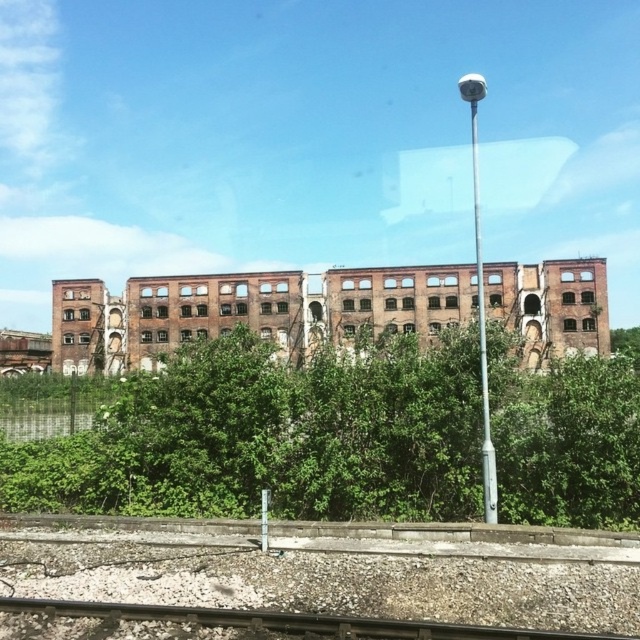
Question: Can you confirm if brown brick building at center is bigger than smooth metal train track at bottom center?

Choices:
 (A) no
 (B) yes

Answer: (B)

Question: Can you confirm if green leafy tree at center is thinner than smooth metal train track at bottom center?

Choices:
 (A) yes
 (B) no

Answer: (B)

Question: Which of the following is the closest to the observer?

Choices:
 (A) brown brick building at center
 (B) green leafy tree at center
 (C) smooth metal train track at bottom center

Answer: (C)

Question: Is green leafy tree at center wider than smooth metal train track at bottom center?

Choices:
 (A) yes
 (B) no

Answer: (A)

Question: Which point appears closest to the camera in this image?

Choices:
 (A) (445, 275)
 (B) (376, 636)
 (C) (509, 369)

Answer: (B)

Question: Which point appears closest to the camera in this image?

Choices:
 (A) (22, 609)
 (B) (573, 440)
 (C) (413, 288)

Answer: (A)